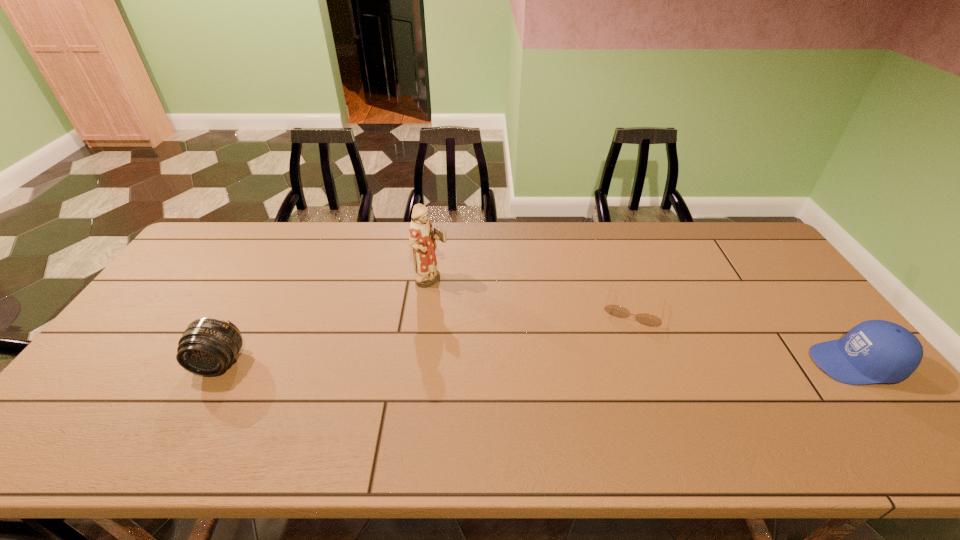
Find the location of a particular element. This screenshot has width=960, height=540. the leftmost object is located at coordinates (207, 346).

Where is `cap`? Image resolution: width=960 pixels, height=540 pixels. cap is located at coordinates coord(875,351).

This screenshot has width=960, height=540. In order to click on figurine in this screenshot , I will do `click(422, 238)`.

This screenshot has height=540, width=960. I want to click on the third object from right to left, so click(422, 238).

Identify the location of the third object from left to right. Image resolution: width=960 pixels, height=540 pixels. (646, 319).

Find the location of a particular element. This screenshot has height=540, width=960. sunglasses is located at coordinates (646, 319).

Locate an element on the screen. vacant area situated 0.060m at the front element of the telephoto lens is located at coordinates (199, 400).

Find the location of `free location located 0.300m on the front-facing side of the cap`. free location located 0.300m on the front-facing side of the cap is located at coordinates (696, 363).

Find the location of a particular element. The image size is (960, 540). free location located on the front-facing side of the cap is located at coordinates (677, 363).

Where is `vacant space located 0.340m on the front-facing side of the cap`? This screenshot has height=540, width=960. vacant space located 0.340m on the front-facing side of the cap is located at coordinates (681, 363).